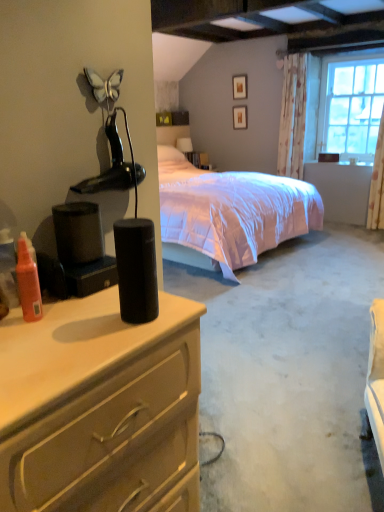
Question: From the image's perspective, is white floral fabric curtain at upper right located above or below black matte speaker at center?

Choices:
 (A) above
 (B) below

Answer: (A)

Question: Considering the positions of white floral fabric curtain at upper right and black matte speaker at center in the image, is white floral fabric curtain at upper right taller or shorter than black matte speaker at center?

Choices:
 (A) short
 (B) tall

Answer: (B)

Question: Estimate the real-world distances between objects in this image. Which object is farther from the matte black speaker at left?

Choices:
 (A) wooden picture frame at upper center, which is the second picture frame in top-to-bottom order
 (B) matte black box at upper center
 (C) clear glass window at upper right
 (D) matte wooden picture frame at upper center, the first picture frame from the top
 (E) black matte lamp at upper left

Answer: (B)

Question: Which object is the closest to the matte black box at upper center?

Choices:
 (A) black matte speaker at center
 (B) wooden picture frame at upper center, the 1th picture frame in the bottom-to-top sequence
 (C) white floral fabric curtain at upper right
 (D) matte wooden picture frame at upper center, the first picture frame from the top
 (E) black matte lamp at upper left

Answer: (B)